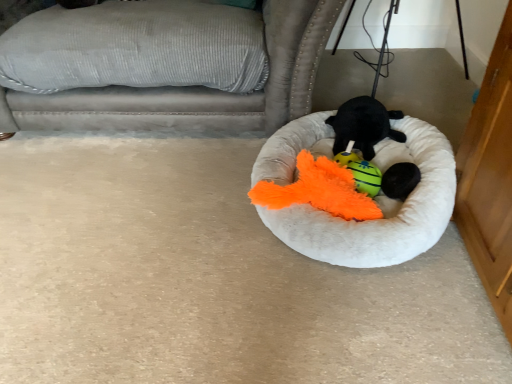
I want to click on free space in front of gray corduroy couch at upper left, so click(x=159, y=233).